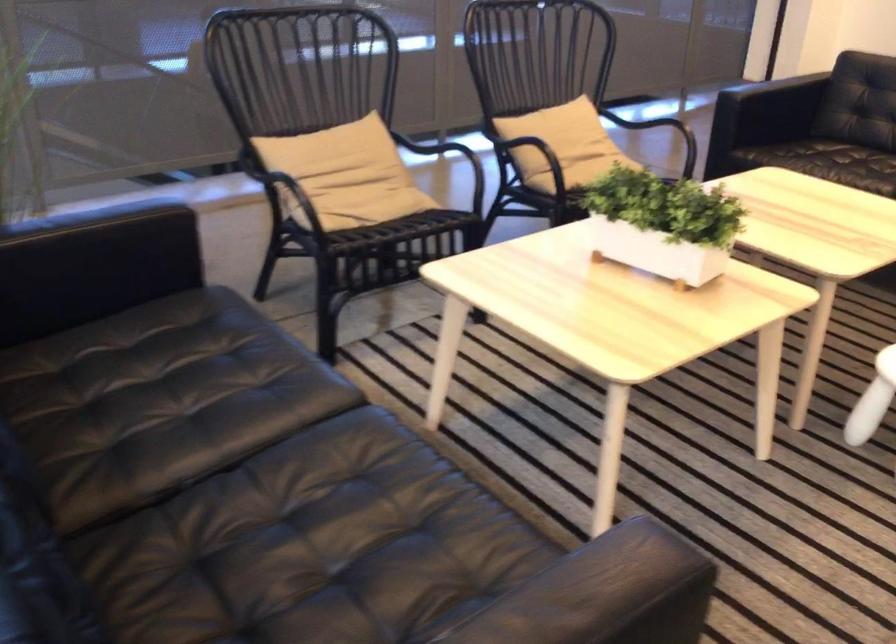
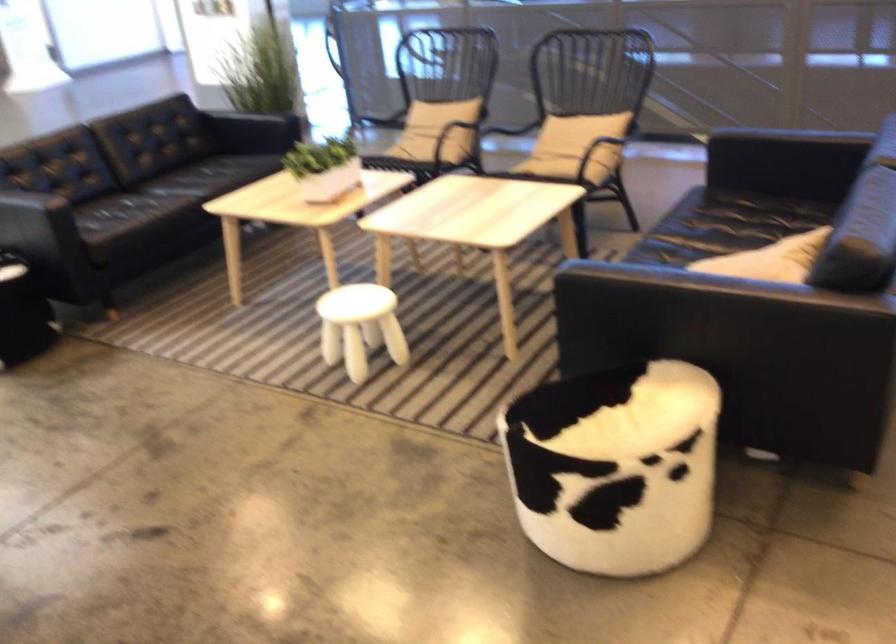
Where in the second image is the point corresponding to pixel 409 180 from the first image?

(450, 135)